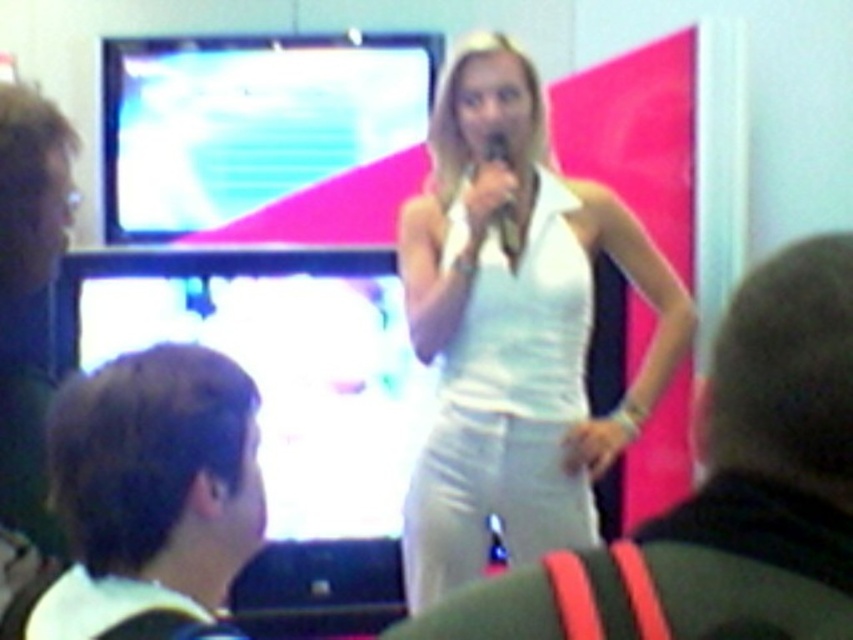
You are attending a presentation and notice two items at the center of the stage. One is the white smooth dress at center and the other is the matte black microphone at center. Which item is located to the right when viewed from the audience perspective?

The white smooth dress at center is positioned on the right side of the matte black microphone at center, so from the audience perspective, the white smooth dress at center is to the right of the matte black microphone at center.

Consider the image. In the scene where a woman in a white smooth dress at center is presenting with a large colorful screen behind her, there are three seated people in front. If you were standing at the point marked by coordinates point (514,330), which object would you be closest to?

You would be closest to the white smooth dress at center since the point (514,330) represents its location.